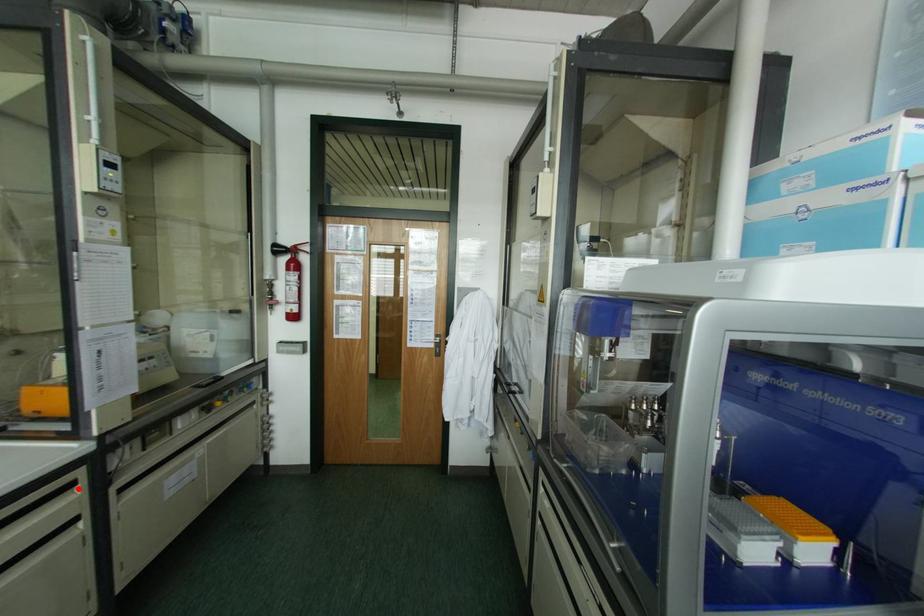
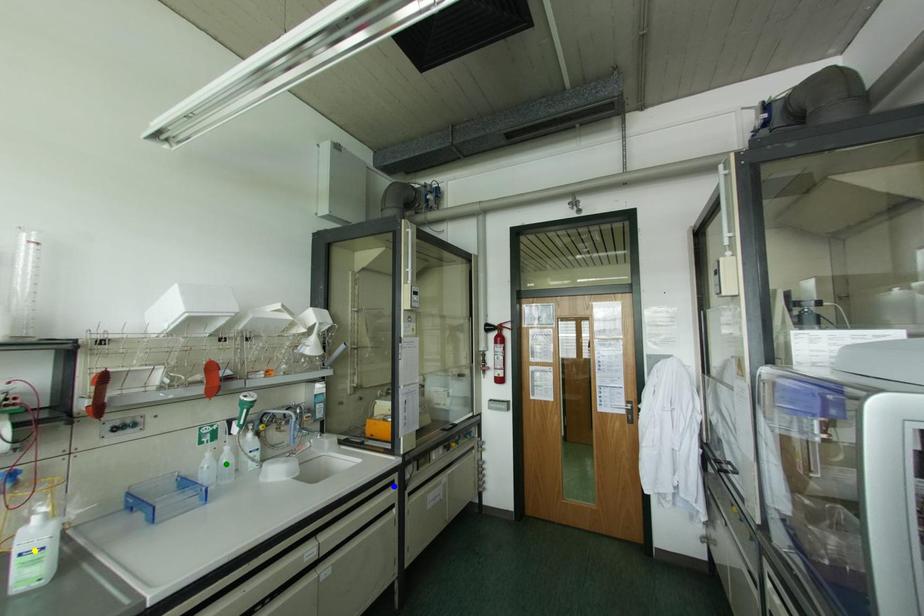
Question: I am providing you with two images of the same scene from different viewpoints. A red point is marked on the first image. You are given multiple points on the second image. Can you choose the point in image 2 that corresponds to the point in image 1?

Choices:
 (A) yellow point
 (B) blue point
 (C) green point

Answer: (B)